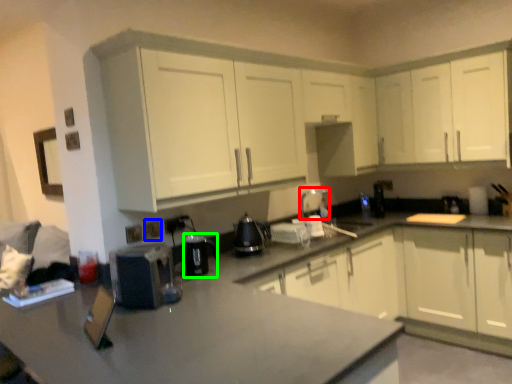
Question: Which object is the farthest from appliance (highlighted by a red box)? Choose among these: electric outlet (highlighted by a blue box) or appliance (highlighted by a green box).

Choices:
 (A) electric outlet
 (B) appliance

Answer: (A)